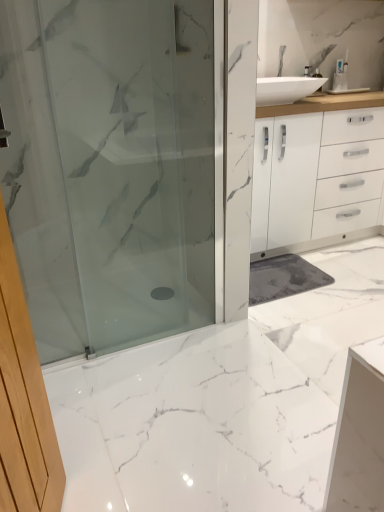
Question: Looking at their shapes, would you say white marble floor at center is wider or thinner than satin glass shower door at center?

Choices:
 (A) wide
 (B) thin

Answer: (A)

Question: In the image, is white marble floor at center positioned in front of or behind satin glass shower door at center?

Choices:
 (A) front
 (B) behind

Answer: (A)

Question: Which is nearer to the white plastic toothbrush at upper right?

Choices:
 (A) white marble floor at center
 (B) satin glass shower door at center

Answer: (B)

Question: Which of these objects is positioned farthest from the white marble floor at center?

Choices:
 (A) white plastic toothbrush at upper right
 (B) satin glass shower door at center

Answer: (A)